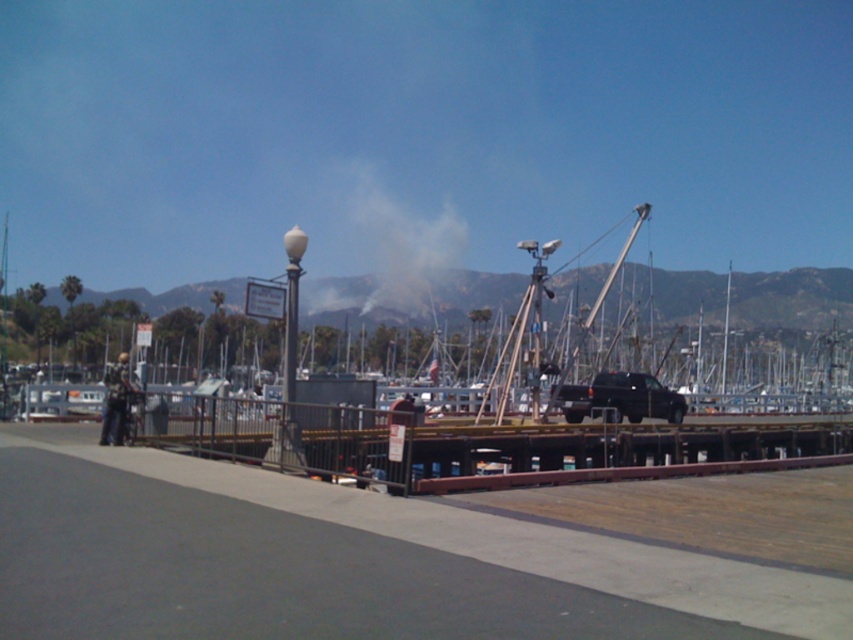
Question: Among these points, which one is nearest to the camera?

Choices:
 (A) (566, 301)
 (B) (381, 221)
 (C) (296, 460)

Answer: (C)

Question: Which object is closer to the camera taking this photo?

Choices:
 (A) white smoke at upper center
 (B) wooden dock at lower center
 (C) white glossy lamp post at center

Answer: (C)

Question: Is wooden dock at lower center closer to the viewer compared to white glossy lamp post at center?

Choices:
 (A) yes
 (B) no

Answer: (B)

Question: Which of the following is the closest to the observer?

Choices:
 (A) white glossy lamp post at center
 (B) wooden dock at lower center

Answer: (A)

Question: Can you confirm if wooden dock at lower center is positioned to the left of white glossy lamp post at center?

Choices:
 (A) yes
 (B) no

Answer: (B)

Question: Observing the image, what is the correct spatial positioning of white smoke at upper center in reference to white glossy lamp post at center?

Choices:
 (A) below
 (B) above

Answer: (B)